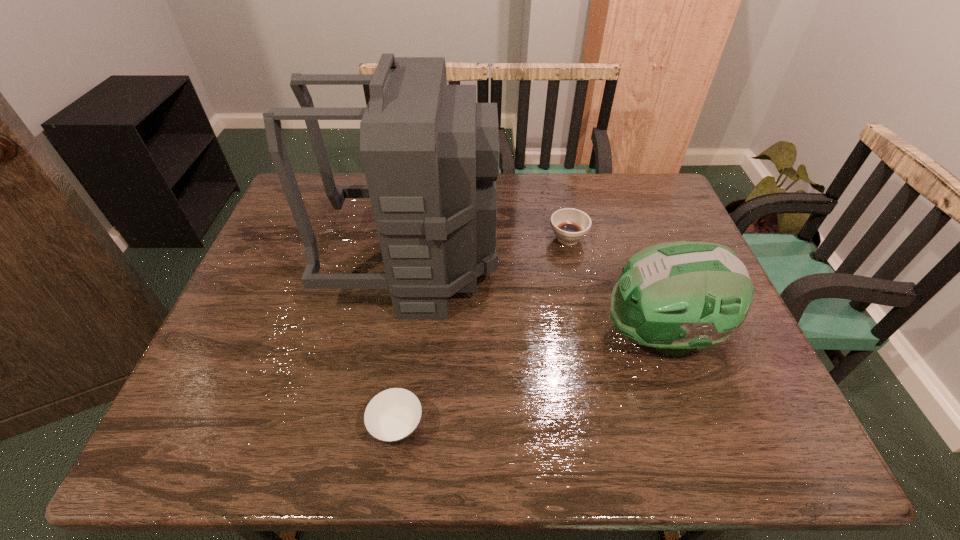
This screenshot has height=540, width=960. In order to click on backpack in this screenshot , I will do `click(430, 153)`.

The width and height of the screenshot is (960, 540). In order to click on the second tallest object in this screenshot , I will do `click(677, 296)`.

Find the location of a particular element. The height and width of the screenshot is (540, 960). the right soup bowl is located at coordinates (570, 225).

Locate an element on the screen. the nearer soup bowl is located at coordinates click(x=392, y=416).

Identify the location of the nearest object. (392, 416).

Where is `free space located on the front compartment of the backpack`? free space located on the front compartment of the backpack is located at coordinates (621, 265).

Find the location of a particular element. The width and height of the screenshot is (960, 540). free space located on the visor of the second tallest object is located at coordinates (561, 335).

Identify the location of free space located 0.090m on the visor of the second tallest object. The image size is (960, 540). (564, 335).

This screenshot has width=960, height=540. What are the coordinates of `free space located 0.290m on the visor of the second tallest object` in the screenshot? It's located at (480, 335).

Find the location of a particular element. The image size is (960, 540). vacant space located 0.090m on the left of the right soup bowl is located at coordinates (517, 238).